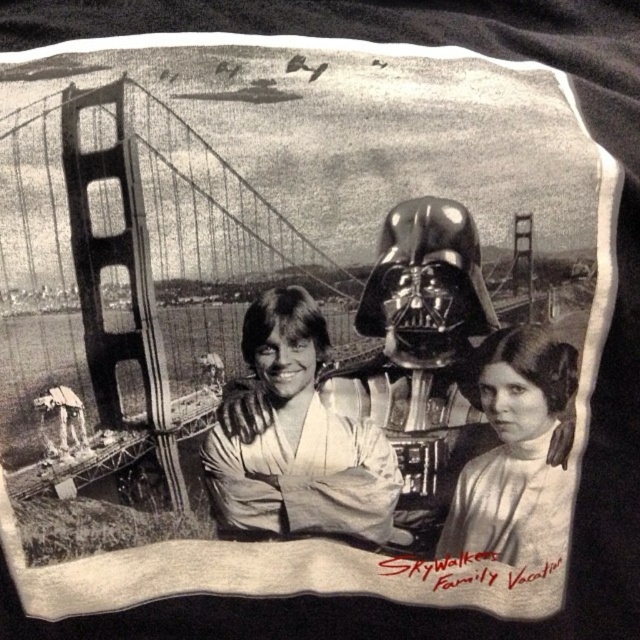
Is the position of smooth white shirt at center less distant than that of smooth skin girl at lower right?

Yes, it is in front of smooth skin girl at lower right.

Between smooth white shirt at center and smooth skin girl at lower right, which one appears on the left side from the viewer's perspective?

smooth white shirt at center

Between point (300, 524) and point (444, 552), which one is positioned behind?

The point (444, 552) is behind.

You are a GUI agent. You are given a task and a screenshot of the screen. Output one action in this format:
    pyautogui.click(x=<x>, y=<y>)
    Task: Click on the smooth white shirt at center
    This screenshot has height=640, width=640.
    Given the screenshot: What is the action you would take?
    pyautogui.click(x=296, y=436)